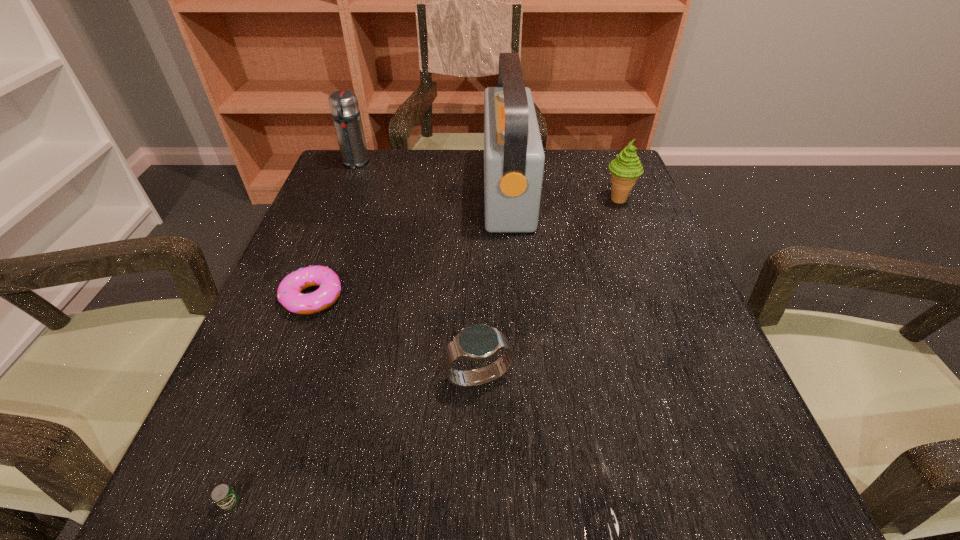
The image size is (960, 540). Identify the location of vacant space that satisfies the following two spatial constraints: 1. with a handle on the side of the thermos bottle; 2. on the left side of the beer can. (220, 502).

Where is `free location that satisfies the following two spatial constraints: 1. on the back side of the beer can; 2. on the left side of the watch`? This screenshot has width=960, height=540. free location that satisfies the following two spatial constraints: 1. on the back side of the beer can; 2. on the left side of the watch is located at coordinates 277,377.

Identify the location of free space that satisfies the following two spatial constraints: 1. on the front-facing side of the radio receiver; 2. on the left side of the rightmost object. (508, 200).